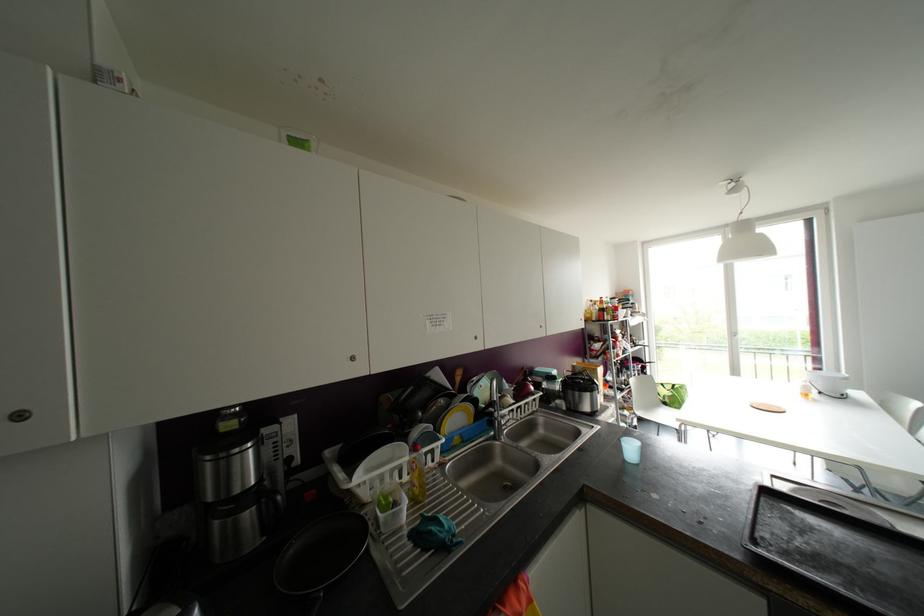
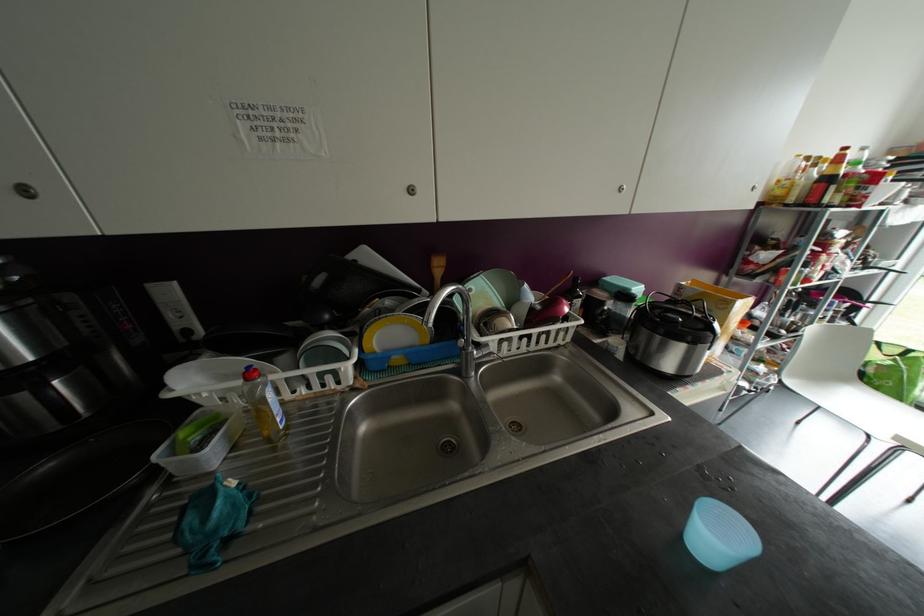
The point at (x=505, y=415) is marked in the first image. Where is the corresponding point in the second image?

(487, 345)